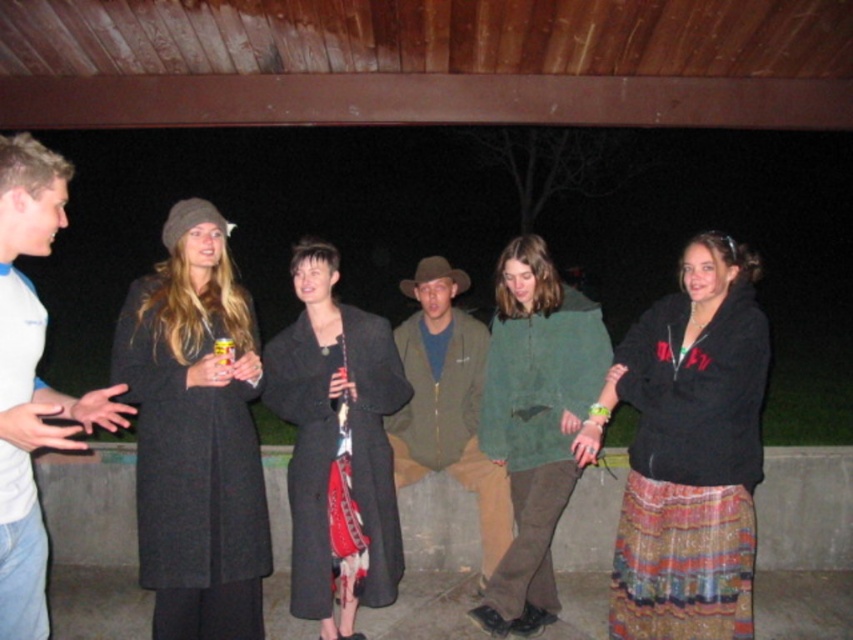
Question: Observing the image, what is the correct spatial positioning of matte black coat at center in reference to green suede jacket at center?

Choices:
 (A) right
 (B) left

Answer: (B)

Question: Which point is closer to the camera taking this photo?

Choices:
 (A) (189, 566)
 (B) (4, 579)
 (C) (296, 566)
 (D) (704, 436)

Answer: (B)

Question: Is black textured hoodie at center closer to the viewer compared to white t-shirt at left?

Choices:
 (A) no
 (B) yes

Answer: (A)

Question: Which point appears closest to the camera in this image?

Choices:
 (A) (317, 480)
 (B) (18, 483)
 (C) (492, 513)
 (D) (178, 500)

Answer: (B)

Question: Is green suede jacket at center wider than green matte jacket at center?

Choices:
 (A) no
 (B) yes

Answer: (A)

Question: Considering the real-world distances, which object is farthest from the green matte jacket at center?

Choices:
 (A) matte black coat at center
 (B) black textured hoodie at center
 (C) dark gray wool coat at left
 (D) white t-shirt at left

Answer: (D)